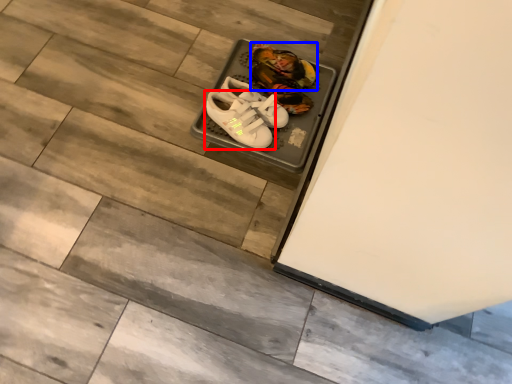
Question: Which point is further to the camera, footwear (highlighted by a red box) or footwear (highlighted by a blue box)?

Choices:
 (A) footwear
 (B) footwear

Answer: (B)